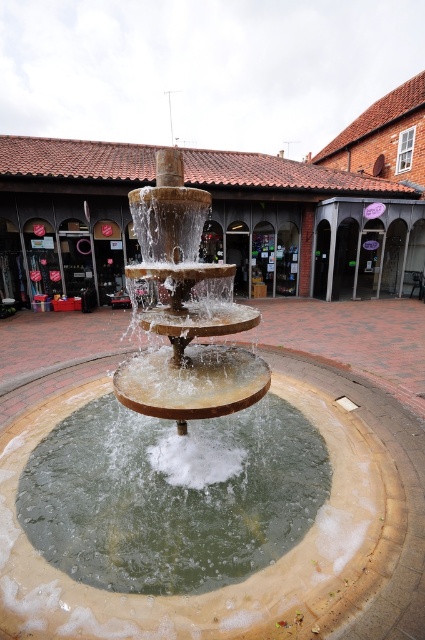
Which of these two, brown stone fountain at center or green stone water at center, stands taller?

Standing taller between the two is brown stone fountain at center.

Does brown stone fountain at center appear under green stone water at center?

No.

The image size is (425, 640). What do you see at coordinates (229, 209) in the screenshot? I see `brown stone fountain at center` at bounding box center [229, 209].

What are the coordinates of `brown stone fountain at center` in the screenshot? It's located at (229, 209).